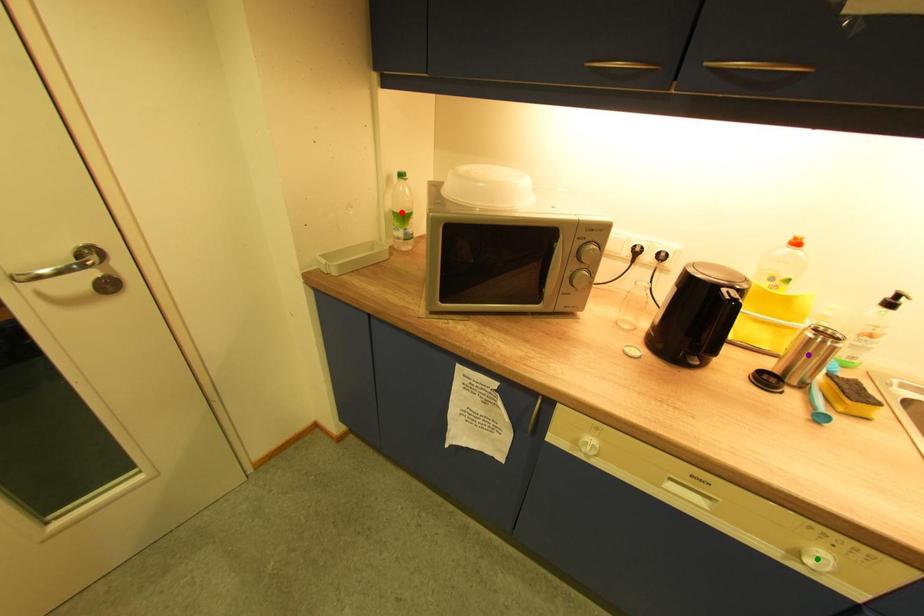
Order these from nearest to farthest:
1. green point
2. purple point
3. red point

red point
purple point
green point